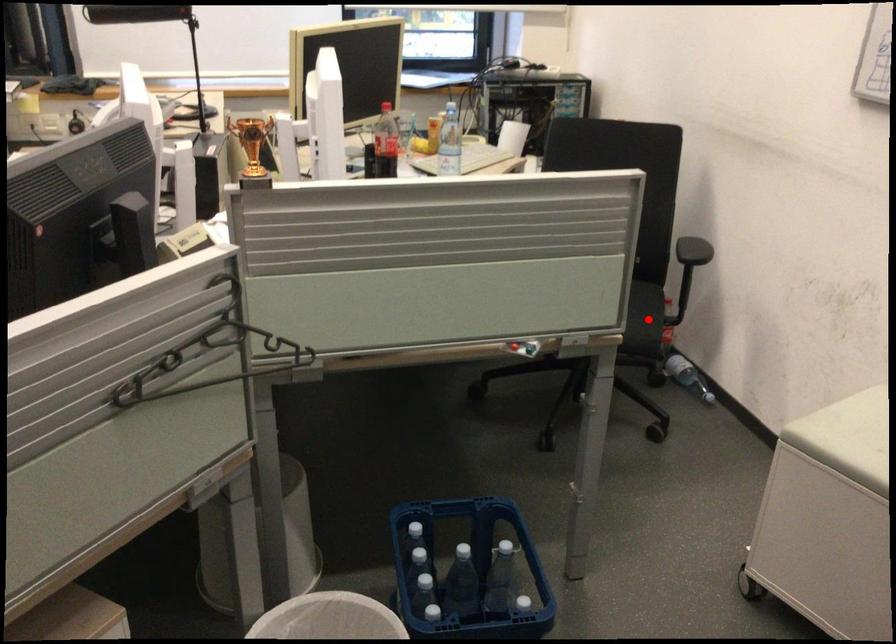
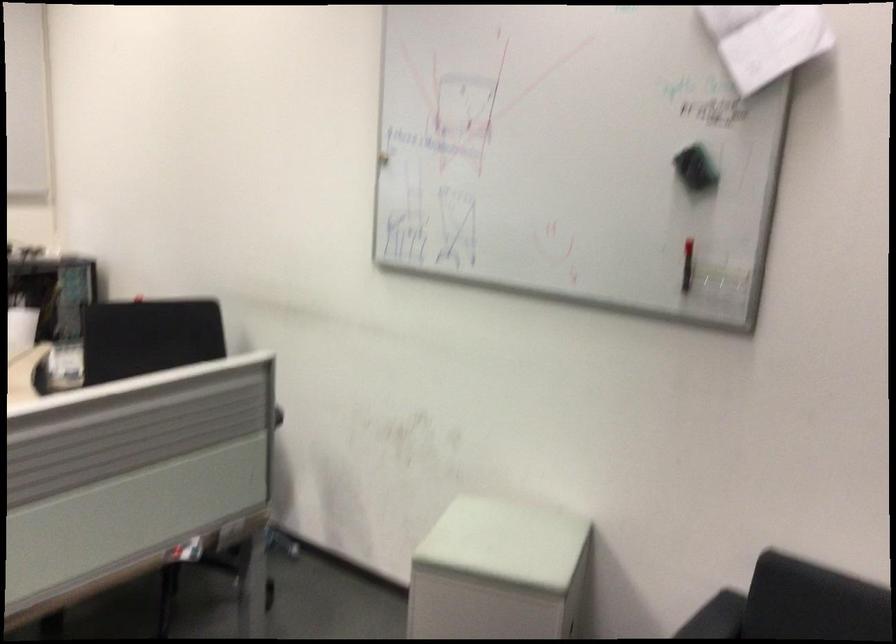
Question: I am providing you with two images of the same scene from different viewpoints. A red point is marked on the first image. Can you still see the location of the red point in image 2?

Choices:
 (A) Yes
 (B) No

Answer: (B)